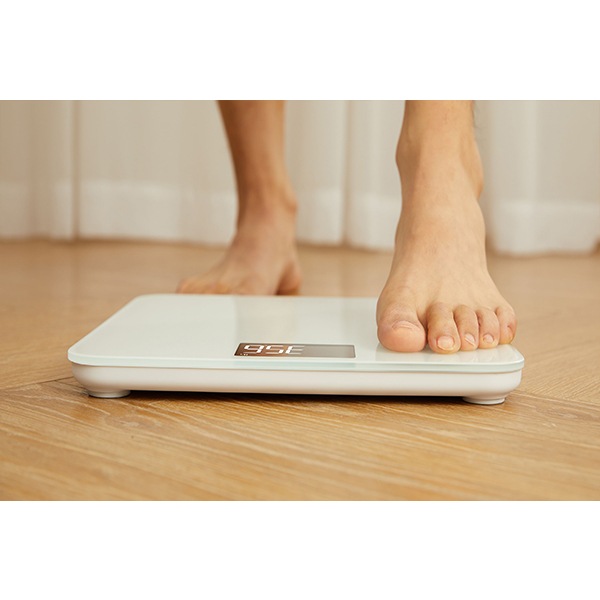
You are a GUI agent. You are given a task and a screenshot of the screen. Output one action in this format:
    pyautogui.click(x=<x>, y=<y>)
    Task: Click on the white billowing shower curtain
    
    Given the screenshot: What is the action you would take?
    pyautogui.click(x=541, y=176)